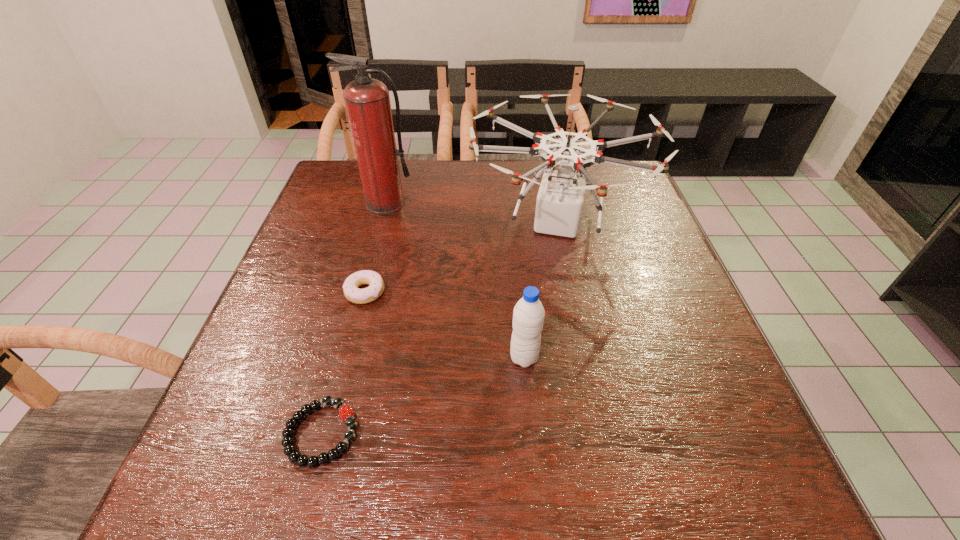
At what (x,y) coordinates should I click in order to perform the action: click on the tallest object. Please return your answer as a coordinate pair (x, y). This screenshot has height=540, width=960. Looking at the image, I should click on (367, 100).

The image size is (960, 540). In order to click on drone in this screenshot , I will do `click(560, 198)`.

Image resolution: width=960 pixels, height=540 pixels. Identify the location of water bottle. (528, 315).

At what (x,y) coordinates should I click in order to perform the action: click on the fourth farthest object. Please return your answer as a coordinate pair (x, y). Looking at the image, I should click on (528, 315).

Where is `the fourth tallest object`? This screenshot has width=960, height=540. the fourth tallest object is located at coordinates (351, 291).

This screenshot has width=960, height=540. I want to click on bracelet, so click(x=346, y=413).

Identify the location of the shortest object. (346, 413).

Locate an element on the screen. vacant region located 0.360m at the nozzle of the tallest object is located at coordinates (355, 319).

You are a GUI agent. You are given a task and a screenshot of the screen. Output one action in this format:
    pyautogui.click(x=<x>, y=<y>)
    Task: Click on the vacant space located 0.250m on the front of the second tallest object
    The width and height of the screenshot is (960, 540).
    Given the screenshot: What is the action you would take?
    pyautogui.click(x=589, y=380)

Where is `vacant region located 0.160m on the front of the fourth farthest object`? Image resolution: width=960 pixels, height=540 pixels. vacant region located 0.160m on the front of the fourth farthest object is located at coordinates (533, 455).